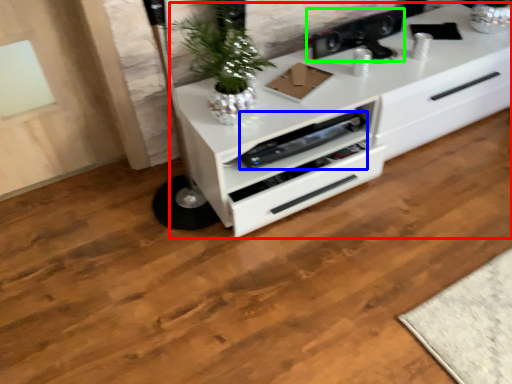
Question: Which is farther away from chest of drawers (highlighted by a red box)? appliance (highlighted by a blue box) or appliance (highlighted by a green box)?

Choices:
 (A) appliance
 (B) appliance

Answer: (B)